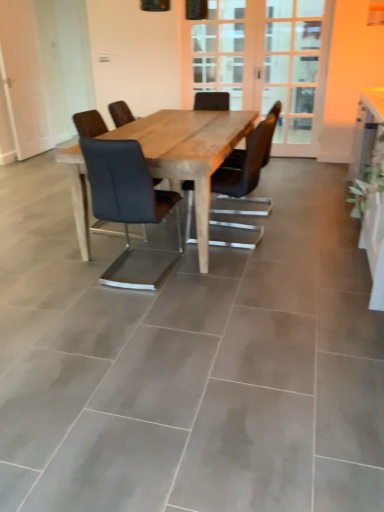
Question: From their relative heights in the image, would you say wooden screen door at center, the second screen door positioned from the right, is taller or shorter than matte black chair at center, the first chair viewed from the left?

Choices:
 (A) short
 (B) tall

Answer: (B)

Question: Considering the positions of point 218,69 and point 127,245, is point 218,69 closer or farther from the camera than point 127,245?

Choices:
 (A) farther
 (B) closer

Answer: (A)

Question: Based on their relative distances, which object is farther from the matte black chair at center, the second chair viewed from the left?

Choices:
 (A) clear glass door at upper center, the second screen door viewed from the left
 (B) matte black chair at center, the second chair in the right-to-left sequence
 (C) white glossy computer desk at right
 (D) natural wood table at center
 (E) green leafy plant at upper right

Answer: (A)

Question: Estimate the real-world distances between objects in this image. Which object is farther from the matte black chair at center, the first chair viewed from the left?

Choices:
 (A) clear glass door at upper center, the second screen door viewed from the left
 (B) wooden screen door at center, which ranks as the 1th screen door in left-to-right order
 (C) white glossy computer desk at right
 (D) matte black chair at center, the 1th chair positioned from the right
 (E) natural wood table at center

Answer: (B)